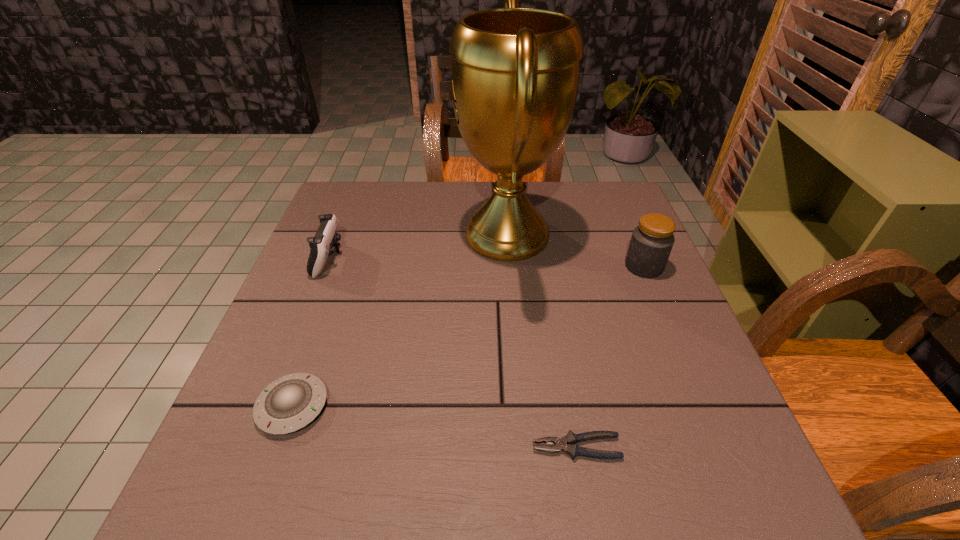
Identify the location of free spot located 0.320m on the surface of the fourth shortest object near the warning symbol. (497, 266).

At what (x,y) coordinates should I click in order to perform the action: click on vacant space located on the surface of the fourth shortest object near the warning symbol. Please return your answer as a coordinate pair (x, y). Looking at the image, I should click on (601, 266).

This screenshot has height=540, width=960. I want to click on vacant region located 0.130m on the front-facing side of the third tallest object, so click(393, 259).

The height and width of the screenshot is (540, 960). I want to click on free location located 0.180m on the back of the second shortest object, so click(326, 310).

Find the location of a particular element. The width and height of the screenshot is (960, 540). vacant point located 0.250m at the gripping part of the pliers is located at coordinates pyautogui.click(x=386, y=447).

This screenshot has height=540, width=960. Identify the location of free spot located 0.170m at the gripping part of the pliers. click(433, 447).

Where is `vacant space located at the gripping part of the pliers`? The image size is (960, 540). vacant space located at the gripping part of the pliers is located at coordinates (392, 447).

Where is `object that is positioned at the far edge`? The height and width of the screenshot is (540, 960). object that is positioned at the far edge is located at coordinates 515,72.

Find the location of `object that is at the near edge`. object that is at the near edge is located at coordinates (568, 444).

This screenshot has height=540, width=960. Identify the location of control located at the left edge. (321, 245).